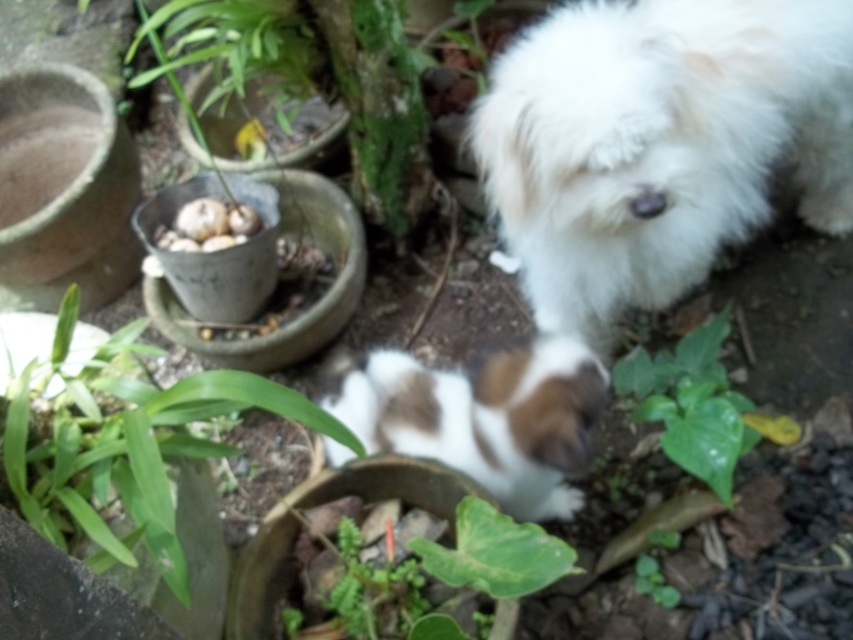
Question: In this image, where is green leafy plant at lower left located relative to white matte eggs at center?

Choices:
 (A) left
 (B) right

Answer: (B)

Question: Is green leafy plant at lower left to the left of white matte eggs at center from the viewer's perspective?

Choices:
 (A) no
 (B) yes

Answer: (A)

Question: Considering the real-world distances, which object is farthest from the white matte eggs at center?

Choices:
 (A) white fluffy dog at upper right
 (B) green leafy plant at lower center

Answer: (B)

Question: Observing the image, what is the correct spatial positioning of green leafy plant at lower left in reference to white matte eggs at center?

Choices:
 (A) above
 (B) below

Answer: (B)

Question: Which is nearer to the green leafy plant at lower left?

Choices:
 (A) white matte eggs at center
 (B) green leafy plant at lower center
 (C) white fluffy dog at upper right
 (D) brown and white fur at center

Answer: (D)

Question: Which of these objects is positioned closest to the green leafy plant at lower left?

Choices:
 (A) green leafy plant at lower center
 (B) white fluffy dog at upper right

Answer: (B)